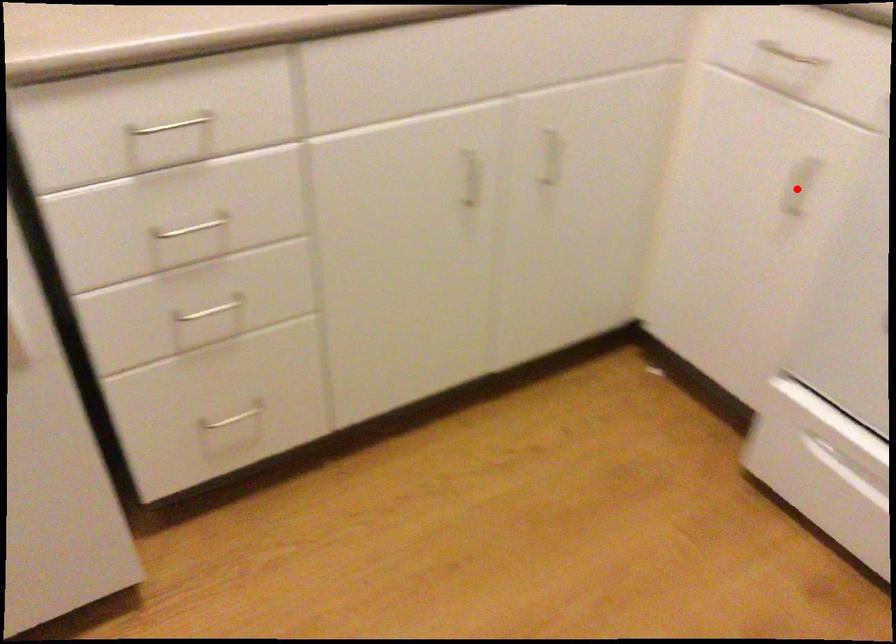
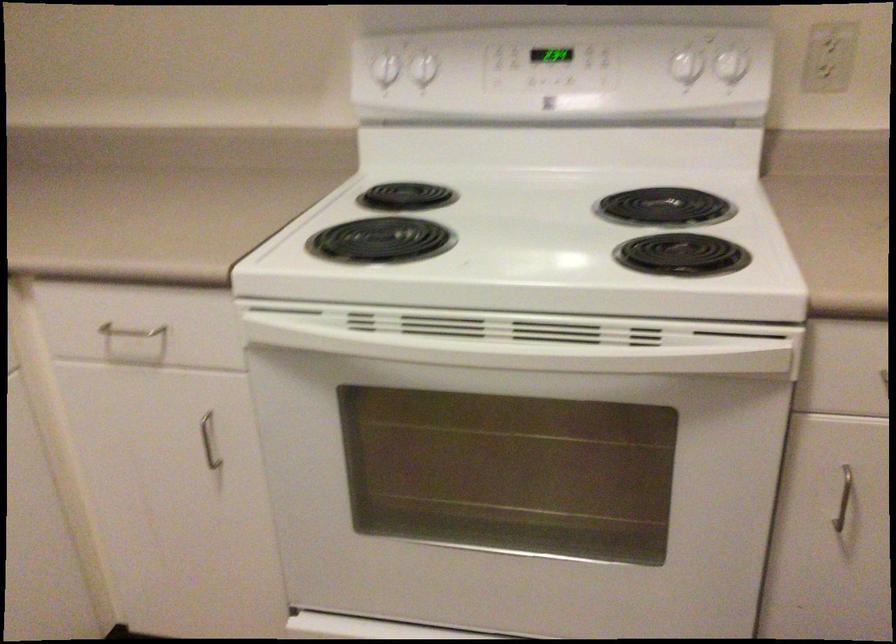
Where in the second image is the point corresponding to the highlighted location from the first image?

(209, 440)